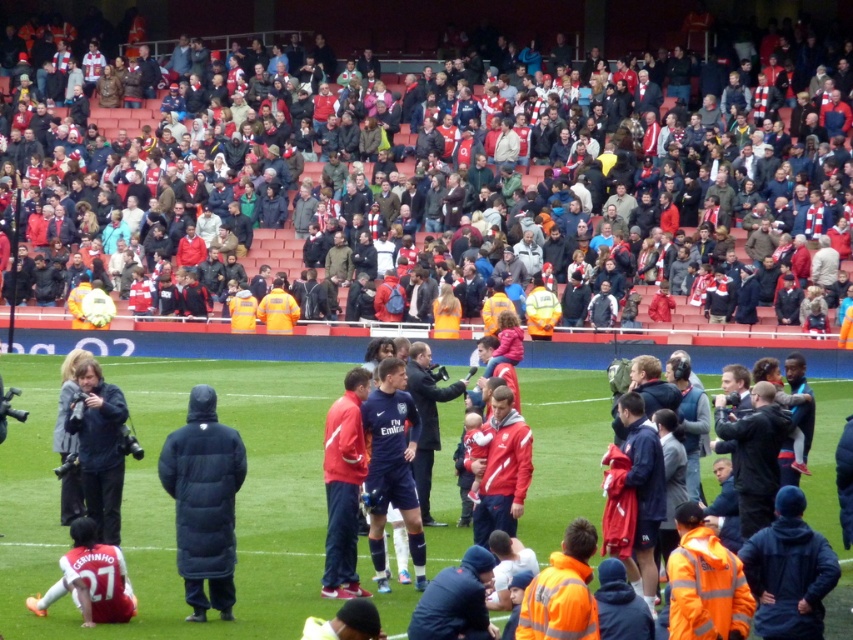
You are a photographer at the stadium and want to capture a photo that includes both the red fabric scarf at upper center and the dark blue puffer jacket at center. Based on their positions, which object should you focus on first to ensure both are in the frame?

The red fabric scarf at upper center is located above the dark blue puffer jacket at center. To include both in the frame, you should focus on the dark blue puffer jacket at center first as it is lower and adjust the camera angle to capture the scarf above it.

You are standing at the edge of the football field and see two points in the image. The first point is at coordinates point (699, 72) and the second point is at point (207, 561). Which point is closer to you?

Point (699, 72) is closer to you because it is further to the viewer than point (207, 561).